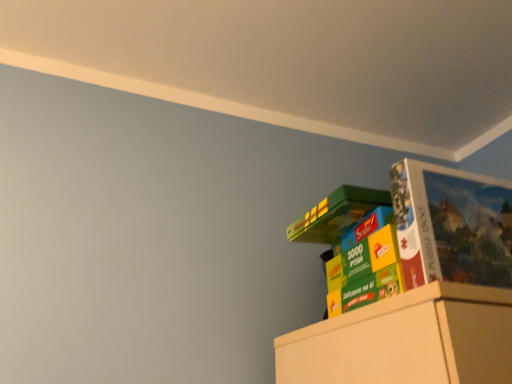
The height and width of the screenshot is (384, 512). What are the coordinates of `matte cardboard puzzle at upper right` in the screenshot? It's located at (452, 225).

The image size is (512, 384). What do you see at coordinates (452, 225) in the screenshot? I see `matte cardboard puzzle at upper right` at bounding box center [452, 225].

Based on the photo, measure the distance between matte cardboard puzzle at upper right and camera.

matte cardboard puzzle at upper right and camera are 29.42 inches apart from each other.

What do you see at coordinates (336, 215) in the screenshot?
I see `multicolored cardboard puzzle box at upper right` at bounding box center [336, 215].

You are a GUI agent. You are given a task and a screenshot of the screen. Output one action in this format:
    pyautogui.click(x=<x>, y=<y>)
    Task: Click on the multicolored cardboard puzzle box at upper right
    The height and width of the screenshot is (384, 512).
    Given the screenshot: What is the action you would take?
    pyautogui.click(x=336, y=215)

Identify the location of matte cardboard puzzle at upper right. Image resolution: width=512 pixels, height=384 pixels. (452, 225).

Between multicolored cardboard puzzle box at upper right and matte cardboard puzzle at upper right, which one appears on the left side from the viewer's perspective?

From the viewer's perspective, multicolored cardboard puzzle box at upper right appears more on the left side.

Is multicolored cardboard puzzle box at upper right positioned in front of matte cardboard puzzle at upper right?

No, multicolored cardboard puzzle box at upper right is behind matte cardboard puzzle at upper right.

Does point (339, 190) come in front of point (452, 268)?

No, (339, 190) is further to viewer.

From the image's perspective, between multicolored cardboard puzzle box at upper right and matte cardboard puzzle at upper right, which one is located above?

matte cardboard puzzle at upper right.

From a real-world perspective, which is physically below, multicolored cardboard puzzle box at upper right or matte cardboard puzzle at upper right?

multicolored cardboard puzzle box at upper right, from a real-world perspective.

Is multicolored cardboard puzzle box at upper right wider or thinner than matte cardboard puzzle at upper right?

In the image, multicolored cardboard puzzle box at upper right appears to be wider than matte cardboard puzzle at upper right.

Considering the sizes of objects multicolored cardboard puzzle box at upper right and matte cardboard puzzle at upper right in the image provided, who is shorter, multicolored cardboard puzzle box at upper right or matte cardboard puzzle at upper right?

matte cardboard puzzle at upper right.

Between multicolored cardboard puzzle box at upper right and matte cardboard puzzle at upper right, which one has smaller size?

Smaller between the two is matte cardboard puzzle at upper right.

Which is correct: multicolored cardboard puzzle box at upper right is inside matte cardboard puzzle at upper right, or outside of it?

multicolored cardboard puzzle box at upper right is not inside matte cardboard puzzle at upper right, it's outside.

In the scene shown: Is multicolored cardboard puzzle box at upper right far away from matte cardboard puzzle at upper right?

No, multicolored cardboard puzzle box at upper right is not far away from matte cardboard puzzle at upper right.

Is multicolored cardboard puzzle box at upper right positioned with its back to matte cardboard puzzle at upper right?

multicolored cardboard puzzle box at upper right is not turned away from matte cardboard puzzle at upper right.

How many degrees apart are the facing directions of multicolored cardboard puzzle box at upper right and matte cardboard puzzle at upper right?

multicolored cardboard puzzle box at upper right and matte cardboard puzzle at upper right are facing 0.00269 degrees away from each other.

This screenshot has width=512, height=384. I want to click on book that is under the matte cardboard puzzle at upper right (from a real-world perspective), so click(336, 215).

Between matte cardboard puzzle at upper right and multicolored cardboard puzzle box at upper right, which one appears on the right side from the viewer's perspective?

From the viewer's perspective, matte cardboard puzzle at upper right appears more on the right side.

Which object is closer to the camera taking this photo, matte cardboard puzzle at upper right or multicolored cardboard puzzle box at upper right?

matte cardboard puzzle at upper right.

Which is behind, point (508, 273) or point (347, 191)?

Positioned behind is point (347, 191).

From the image's perspective, would you say matte cardboard puzzle at upper right is shown under multicolored cardboard puzzle box at upper right?

Actually, matte cardboard puzzle at upper right appears above multicolored cardboard puzzle box at upper right in the image.

From a real-world perspective, is matte cardboard puzzle at upper right positioned above or below multicolored cardboard puzzle box at upper right?

From a real-world perspective, matte cardboard puzzle at upper right is physically above multicolored cardboard puzzle box at upper right.

Between matte cardboard puzzle at upper right and multicolored cardboard puzzle box at upper right, which one has smaller width?

With smaller width is matte cardboard puzzle at upper right.

Is matte cardboard puzzle at upper right taller than multicolored cardboard puzzle box at upper right?

Incorrect, the height of matte cardboard puzzle at upper right is not larger of that of multicolored cardboard puzzle box at upper right.

Considering the sizes of matte cardboard puzzle at upper right and multicolored cardboard puzzle box at upper right in the image, is matte cardboard puzzle at upper right bigger or smaller than multicolored cardboard puzzle box at upper right?

In the image, matte cardboard puzzle at upper right appears to be smaller than multicolored cardboard puzzle box at upper right.

Is multicolored cardboard puzzle box at upper right completely or partially inside matte cardboard puzzle at upper right?

That's incorrect, multicolored cardboard puzzle box at upper right is not inside matte cardboard puzzle at upper right.

Would you consider matte cardboard puzzle at upper right to be distant from multicolored cardboard puzzle box at upper right?

Actually, matte cardboard puzzle at upper right and multicolored cardboard puzzle box at upper right are a little close together.

Is matte cardboard puzzle at upper right oriented towards multicolored cardboard puzzle box at upper right?

No, matte cardboard puzzle at upper right is not aimed at multicolored cardboard puzzle box at upper right.

What's the angular difference between matte cardboard puzzle at upper right and multicolored cardboard puzzle box at upper right's facing directions?

0.00269 degrees separate the facing orientations of matte cardboard puzzle at upper right and multicolored cardboard puzzle box at upper right.

In order to click on book below the matte cardboard puzzle at upper right (from a real-world perspective) in this screenshot , I will do `click(336, 215)`.

Identify the location of paperback book on the right of multicolored cardboard puzzle box at upper right. (452, 225).

Where is `book below the matte cardboard puzzle at upper right (from a real-world perspective)`? book below the matte cardboard puzzle at upper right (from a real-world perspective) is located at coordinates 336,215.